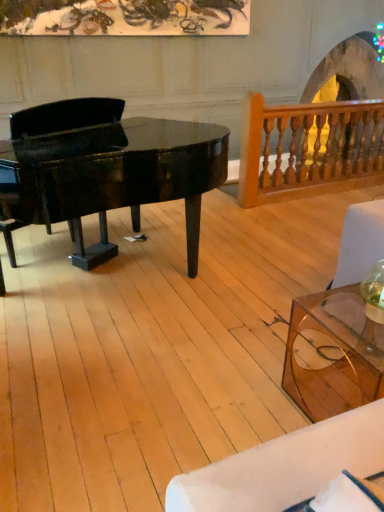
In order to click on vacant area that is situated to the right of glossy black piano at left in this screenshot , I will do `click(266, 290)`.